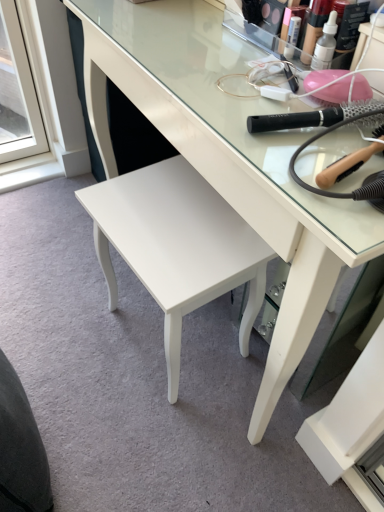
What are the coordinates of `free space above white glossy stool at center (from a real-world perspective)` in the screenshot? It's located at (167, 212).